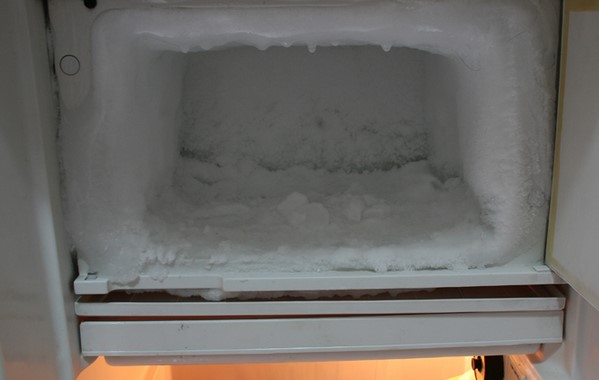
At what (x,y) coordinates should I click in order to perform the action: click on white wall. Please return your answer as a coordinate pair (x, y). Looking at the image, I should click on (40, 220), (577, 137).